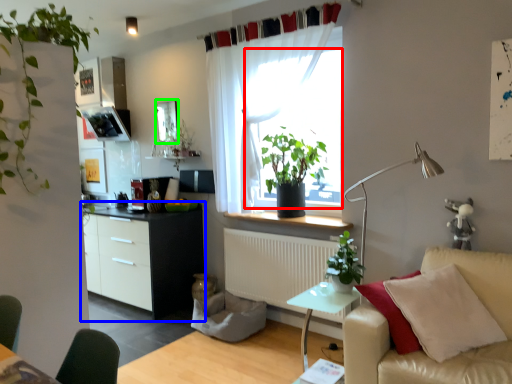
Question: Which object is the closest to the window screen (highlighted by a red box)? Choose among these: cabinetry (highlighted by a blue box) or window screen (highlighted by a green box).

Choices:
 (A) cabinetry
 (B) window screen

Answer: (A)